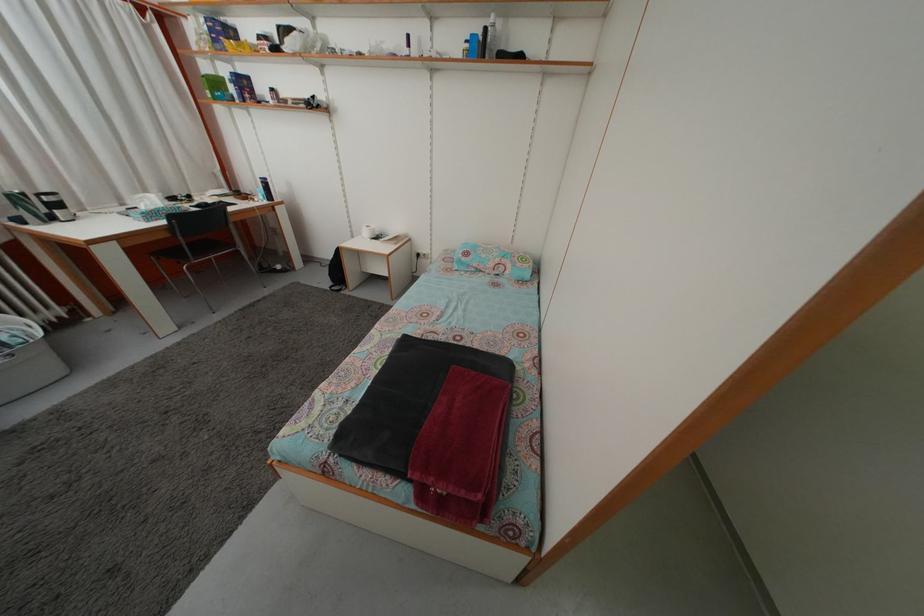
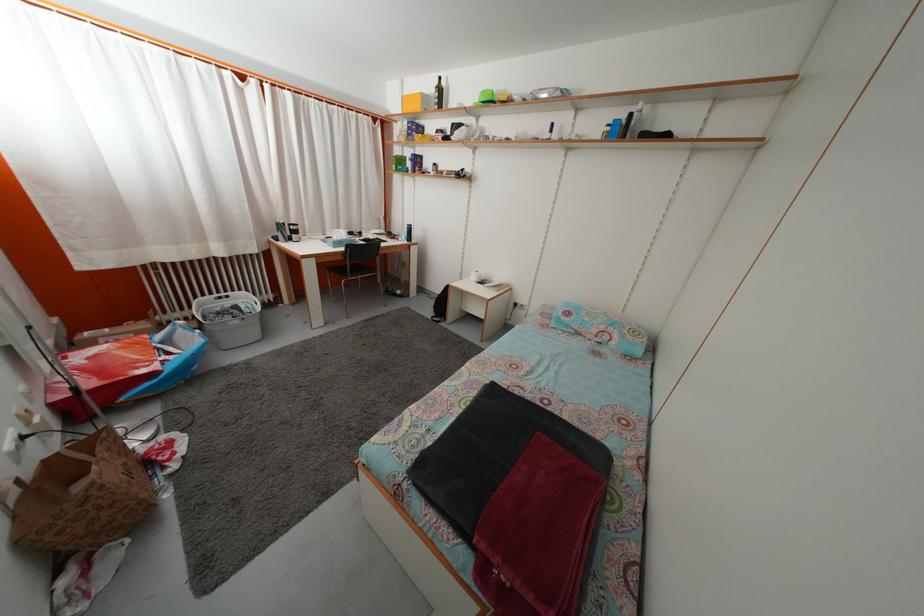
In a continuous first-person perspective shot, in which direction is the camera moving?

The movement direction of the cameraman is left, backward.